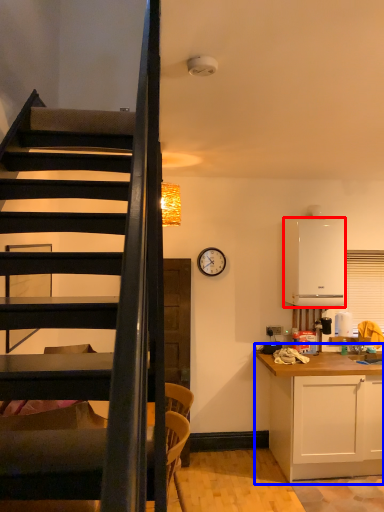
Question: Which point is further to the camera, appliance (highlighted by a red box) or cabinetry (highlighted by a blue box)?

Choices:
 (A) appliance
 (B) cabinetry

Answer: (A)